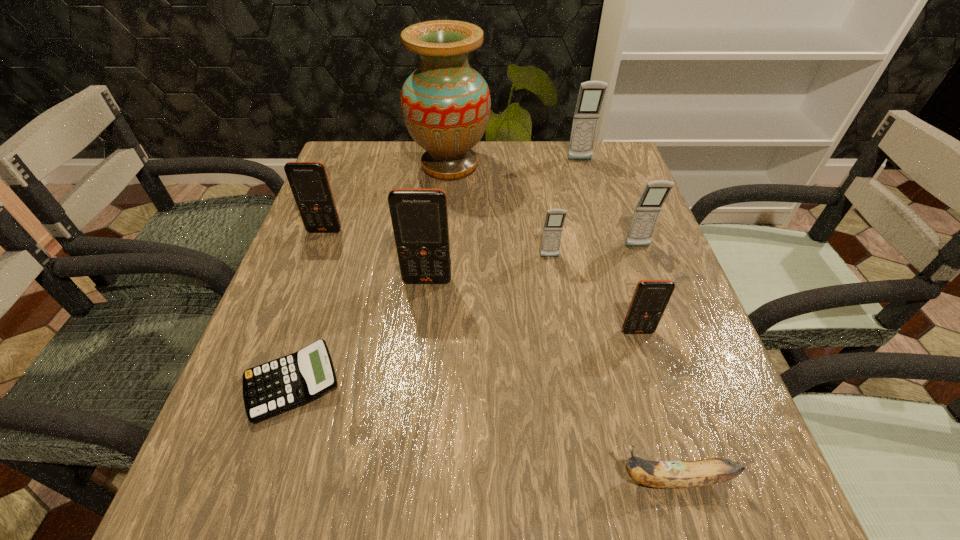
Find the location of a particular element. The height and width of the screenshot is (540, 960). the third nearest object is located at coordinates (650, 299).

Where is `the third cellular telephone from left to right`? The image size is (960, 540). the third cellular telephone from left to right is located at coordinates (552, 232).

Image resolution: width=960 pixels, height=540 pixels. I want to click on the fifth farthest object, so click(552, 232).

Locate an element on the screen. The width and height of the screenshot is (960, 540). yellow banana is located at coordinates (658, 474).

At what (x,y) coordinates should I click in order to perform the action: click on the second shortest object. Please return your answer as a coordinate pair (x, y). Looking at the image, I should click on (658, 474).

This screenshot has width=960, height=540. What are the coordinates of `the eighth farthest object` in the screenshot? It's located at (285, 383).

Locate an element on the screen. the shortest object is located at coordinates (285, 383).

I want to click on vacant space located 0.280m on the front of the tallest object, so click(441, 264).

The width and height of the screenshot is (960, 540). I want to click on free region located 0.130m on the front-facing side of the farthest gray cellular telephone, so pos(588,190).

Find the location of a particular element. blank area located on the screen of the biggest orange cellular telephone is located at coordinates [420, 351].